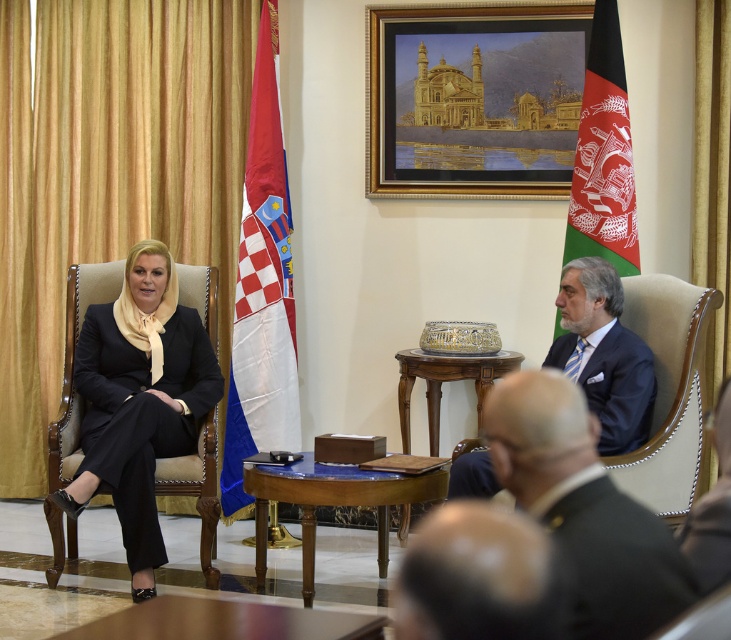
You are a photographer positioned at the back of the room. You want to take a clear photo of the dark blue suit at center and the mahogany wood table at center. Which object should you focus on first to ensure both are in focus?

The dark blue suit at center is closer to the viewer than the mahogany wood table at center. To ensure both are in focus, you should focus on the dark blue suit at center first, as it is closer, and use a smaller aperture to maximize depth of field.

What object is located at the coordinates point (x=137, y=403) in the image?

The point (x=137, y=403) indicates the black satin suit at left.